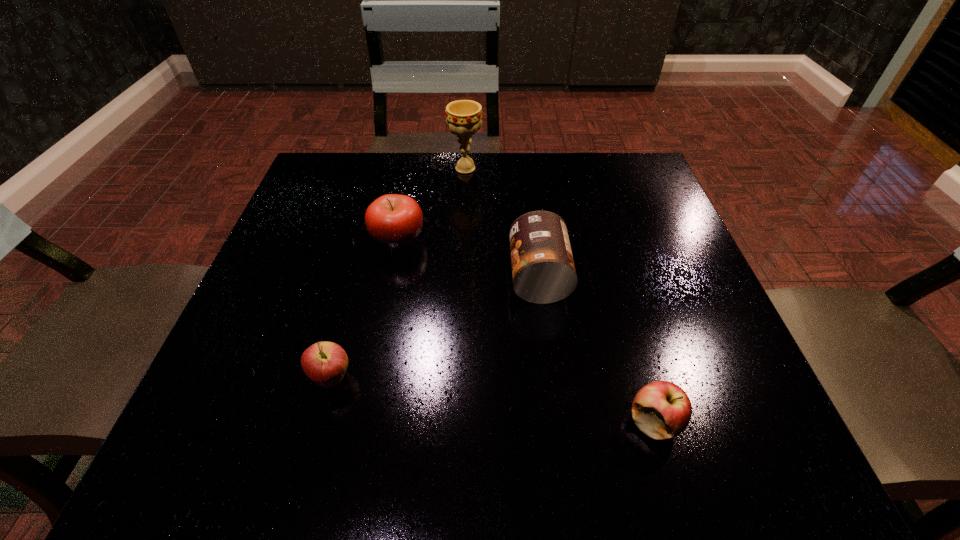
Where is `vacant space located on the front label of the can`? The width and height of the screenshot is (960, 540). vacant space located on the front label of the can is located at coordinates (411, 276).

Locate an element on the screen. Image resolution: width=960 pixels, height=540 pixels. free space located on the front label of the can is located at coordinates (317, 276).

Identify the location of free space located 0.170m on the back of the second farthest apple. (357, 285).

You are a GUI agent. You are given a task and a screenshot of the screen. Output one action in this format:
    pyautogui.click(x=<x>, y=<y>)
    Task: Click on the vacant position located 0.240m on the back of the rightmost object
    The image size is (960, 540).
    Given the screenshot: What is the action you would take?
    pyautogui.click(x=613, y=284)

Identify the location of object that is positioned at the far edge. (463, 117).

Identify the location of object present at the near edge. This screenshot has width=960, height=540. (662, 410).

At what (x,y) coordinates should I click in order to perform the action: click on object present at the left edge. Please return your answer as a coordinate pair (x, y). The height and width of the screenshot is (540, 960). Looking at the image, I should click on (325, 363).

You are a GUI agent. You are given a task and a screenshot of the screen. Output one action in this format:
    pyautogui.click(x=<x>, y=<y>)
    Task: Click on the object that is at the right edge
    This screenshot has width=960, height=540.
    Given the screenshot: What is the action you would take?
    pyautogui.click(x=662, y=410)

The image size is (960, 540). I want to click on object positioned at the near right corner, so click(x=662, y=410).

Locate an element on the screen. Image resolution: width=960 pixels, height=540 pixels. vacant region at the far edge of the desktop is located at coordinates (488, 189).